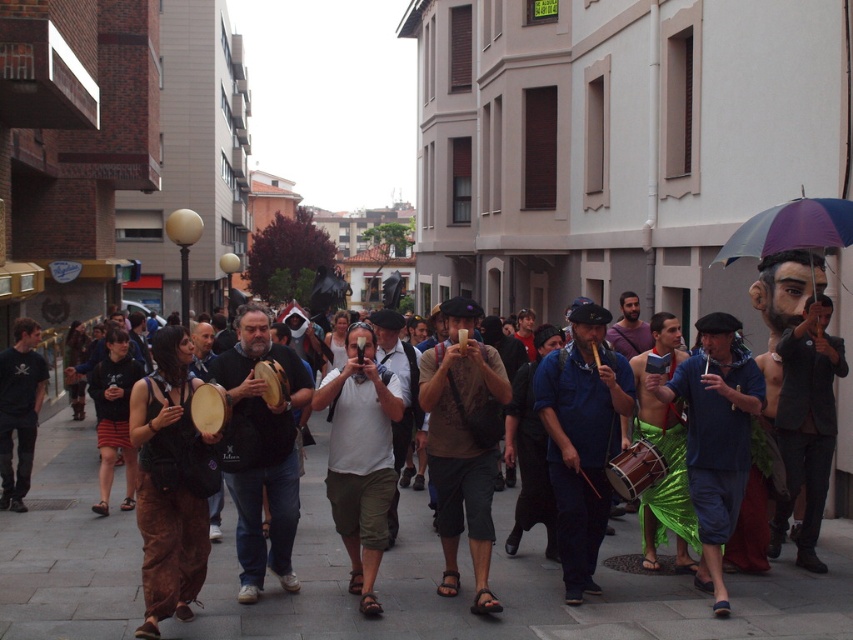
From the picture: How much distance is there between gray concrete pavement at center and brown leather bag at center?

gray concrete pavement at center is 1.35 meters from brown leather bag at center.

Can you confirm if gray concrete pavement at center is positioned below brown leather bag at center?

Indeed, gray concrete pavement at center is positioned under brown leather bag at center.

Is point (61, 477) positioned in front of point (488, 468)?

No, it is not.

The height and width of the screenshot is (640, 853). I want to click on gray concrete pavement at center, so click(x=508, y=589).

Who is taller, brown leather bag at center or shiny green skirt at center?

Standing taller between the two is brown leather bag at center.

I want to click on brown leather bag at center, so click(463, 444).

Image resolution: width=853 pixels, height=640 pixels. I want to click on brown leather bag at center, so click(463, 444).

Can you confirm if gray concrete pavement at center is shorter than white matte camera at center?

Correct, gray concrete pavement at center is not as tall as white matte camera at center.

Between gray concrete pavement at center and white matte camera at center, which one appears on the right side from the viewer's perspective?

white matte camera at center

Does point (108, 611) lie behind point (343, 372)?

No, (108, 611) is in front of (343, 372).

Where is `gray concrete pavement at center`? This screenshot has width=853, height=640. gray concrete pavement at center is located at coordinates (508, 589).